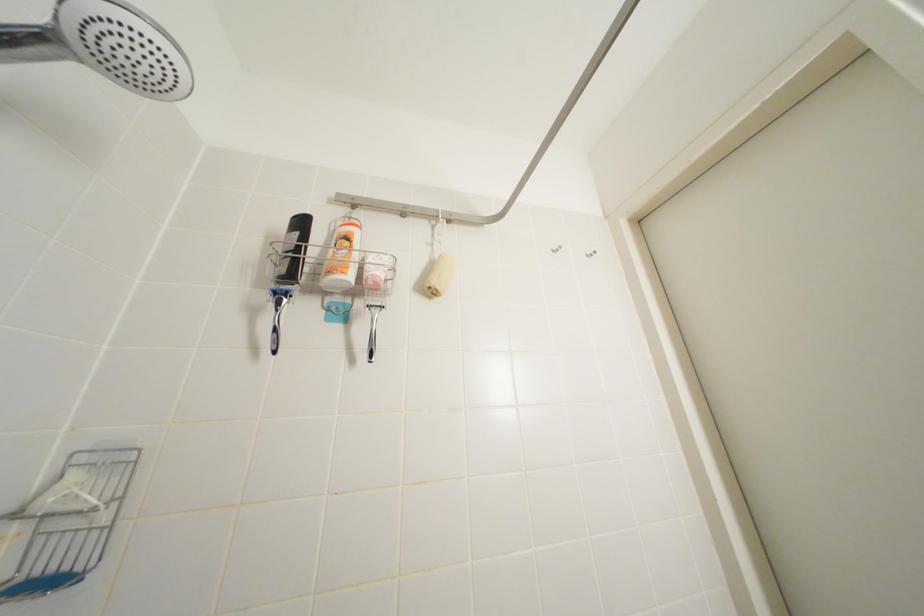
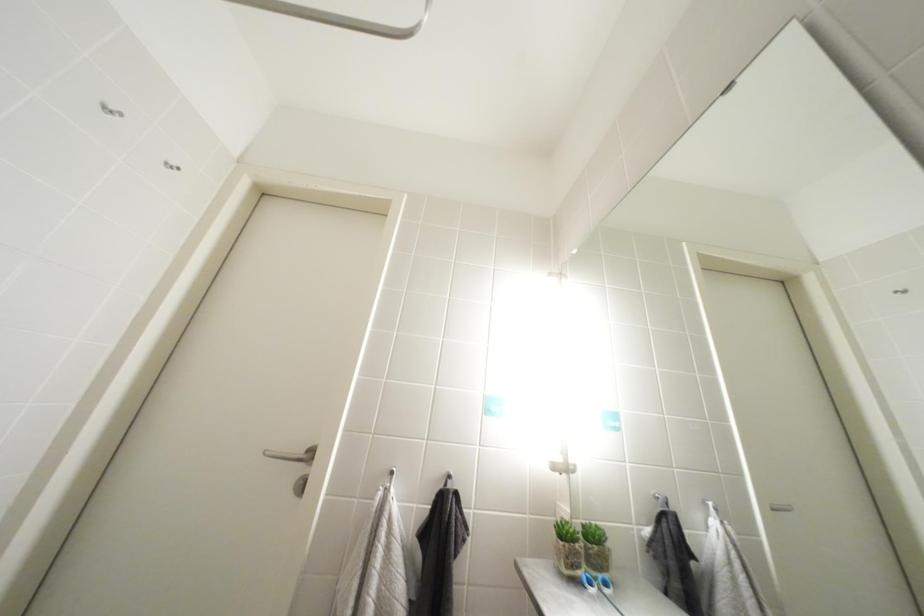
How did the camera likely rotate?

The camera rotated toward right-up.